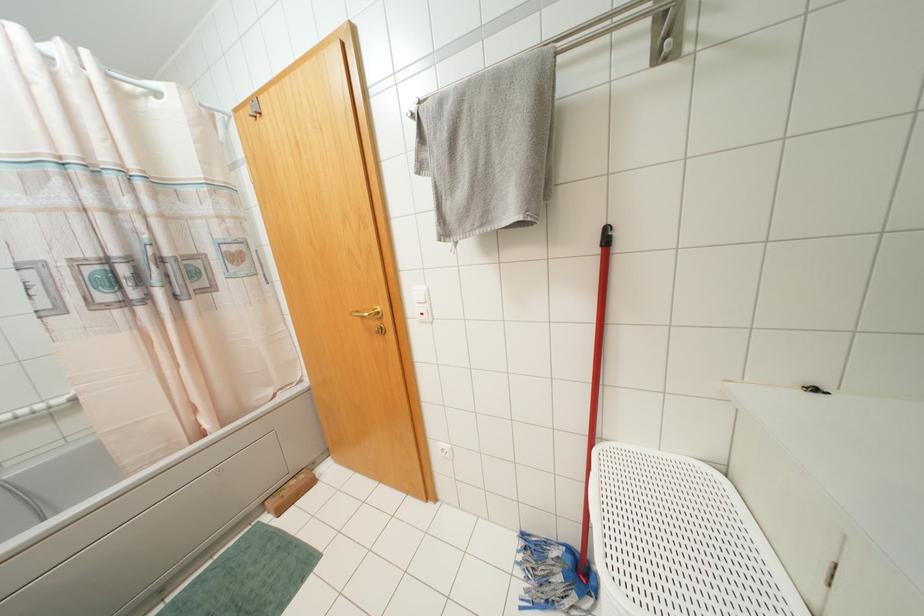
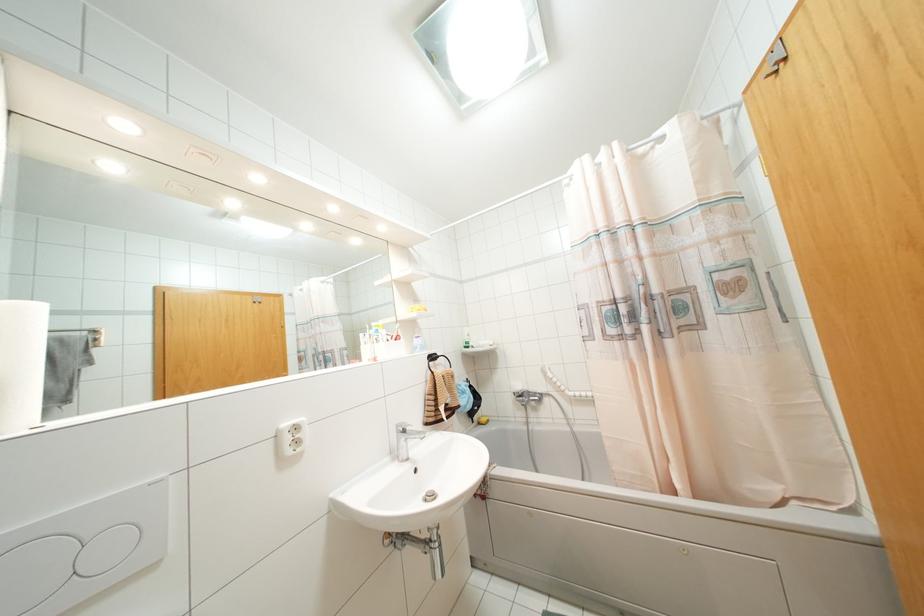
Question: How did the camera likely rotate?

Choices:
 (A) Left
 (B) Right
 (C) Up
 (D) Down

Answer: (A)